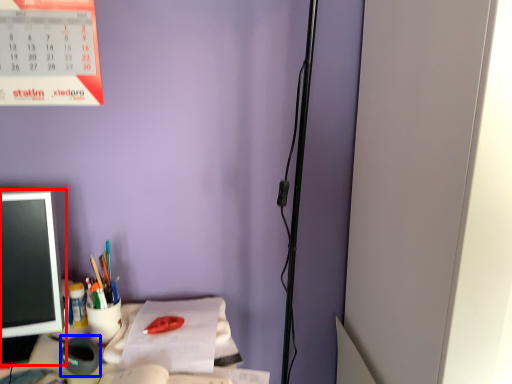
Question: Among these objects, which one is nearest to the camera, office supplies (highlighted by a red box) or stationery (highlighted by a blue box)?

Choices:
 (A) office supplies
 (B) stationery

Answer: (A)